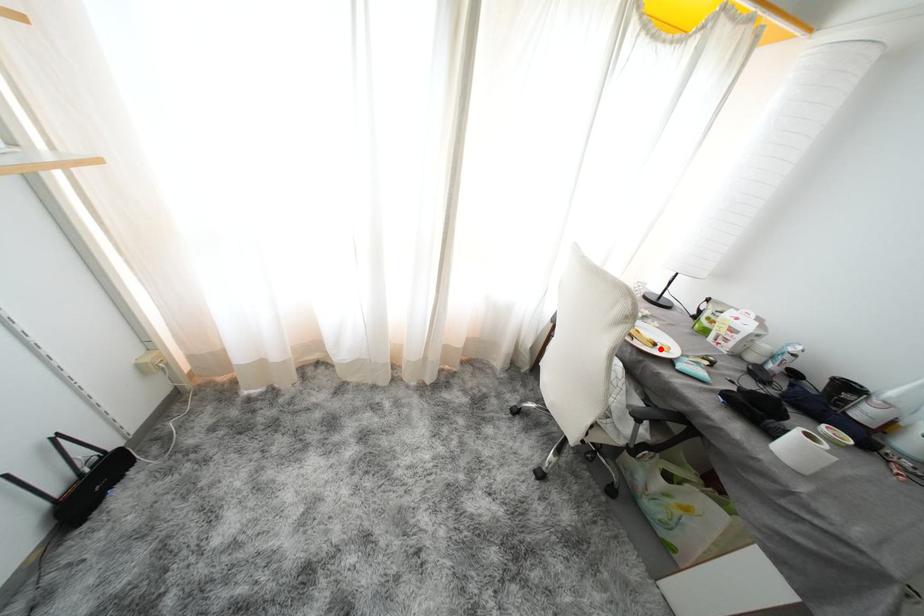
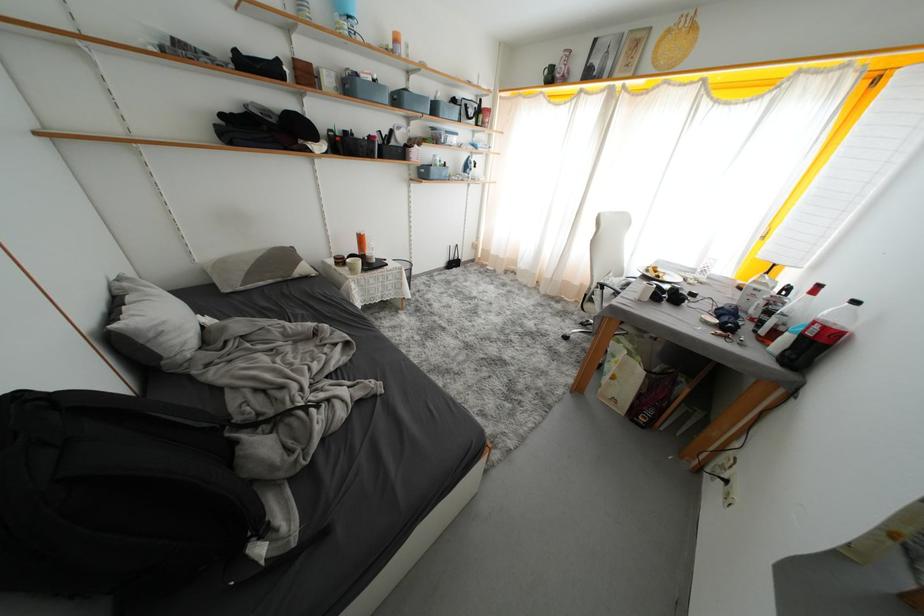
Question: A red point is marked in image1. In image2, is the corresponding 3D point closer to the camera or farther? Reply with the corresponding letter.

Choices:
 (A) The corresponding 3D point is closer.
 (B) The corresponding 3D point is farther.

Answer: (A)